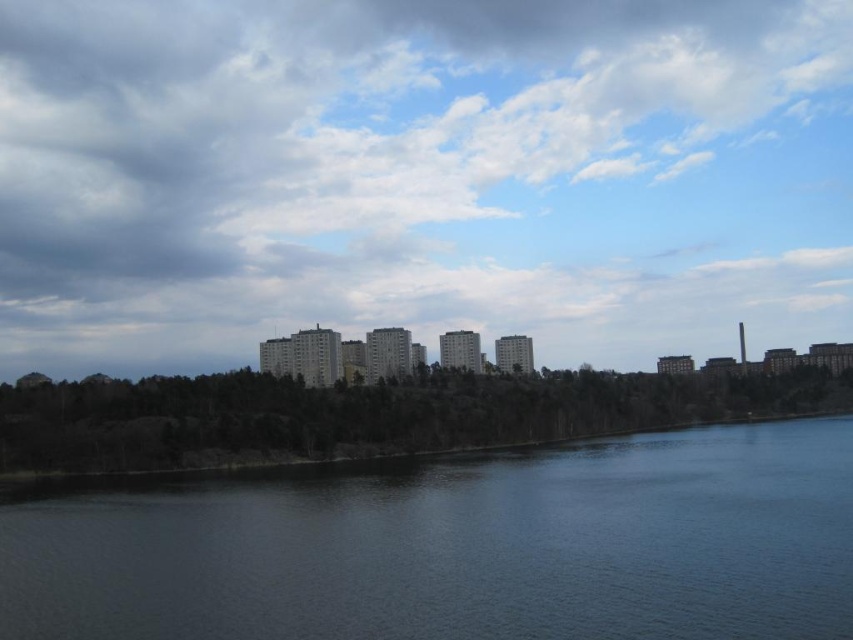
Question: Based on their relative distances, which object is nearer to the green matte trees at lower center?

Choices:
 (A) cloudy sky at center
 (B) dark blue water at lower center

Answer: (B)

Question: Can you confirm if cloudy sky at center is wider than green matte trees at lower center?

Choices:
 (A) yes
 (B) no

Answer: (A)

Question: Can you confirm if cloudy sky at center is thinner than green matte trees at lower center?

Choices:
 (A) yes
 (B) no

Answer: (B)

Question: Among these points, which one is farthest from the camera?

Choices:
 (A) (700, 499)
 (B) (434, 392)

Answer: (B)

Question: Observing the image, what is the correct spatial positioning of cloudy sky at center in reference to green matte trees at lower center?

Choices:
 (A) right
 (B) left

Answer: (B)

Question: Which point is closer to the camera?

Choices:
 (A) dark blue water at lower center
 (B) green matte trees at lower center

Answer: (A)